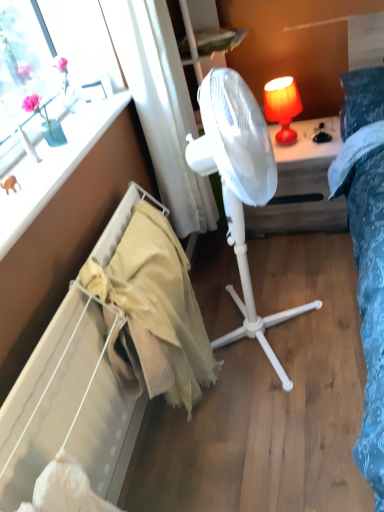
Question: From their relative heights in the image, would you say white plastic fan at center is taller or shorter than white plastic fan at center?

Choices:
 (A) tall
 (B) short

Answer: (B)

Question: In terms of width, does white plastic fan at center look wider or thinner when compared to white plastic fan at center?

Choices:
 (A) wide
 (B) thin

Answer: (A)

Question: Which of these objects is positioned closest to the matte white window sill at upper left?

Choices:
 (A) white plastic fan at center
 (B) matte orange lampshade at upper right
 (C) white plastic fan at center
 (D) beige cotton blanket at lower left
 (E) beige fabric radiator at lower left

Answer: (E)

Question: Which is nearer to the white plastic fan at center?

Choices:
 (A) white sheer curtain at upper center
 (B) beige fabric radiator at lower left
 (C) white plastic fan at center
 (D) beige cotton blanket at lower left
 (E) matte orange lampshade at upper right

Answer: (E)